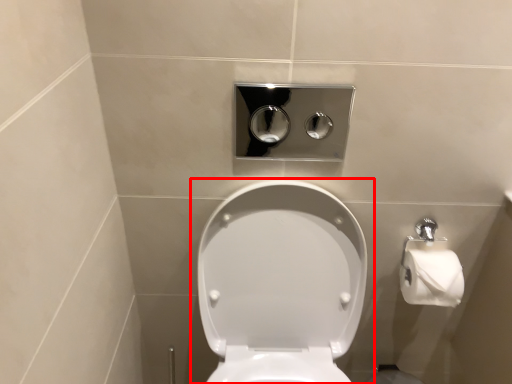
Question: From the image's perspective, where is toilet (annotated by the red box) located in relation to dispenser in the image?

Choices:
 (A) below
 (B) above

Answer: (A)